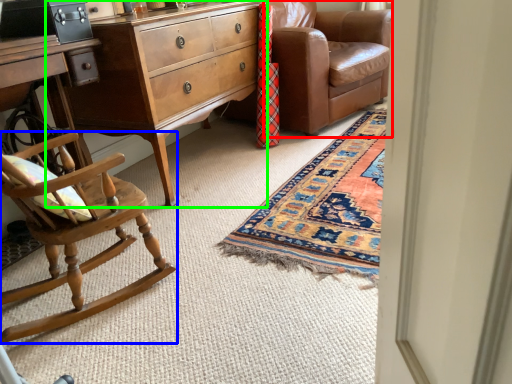
Question: Which is nearer to the studio couch (highlighted by a red box)? chair (highlighted by a blue box) or nightstand (highlighted by a green box).

Choices:
 (A) chair
 (B) nightstand

Answer: (B)